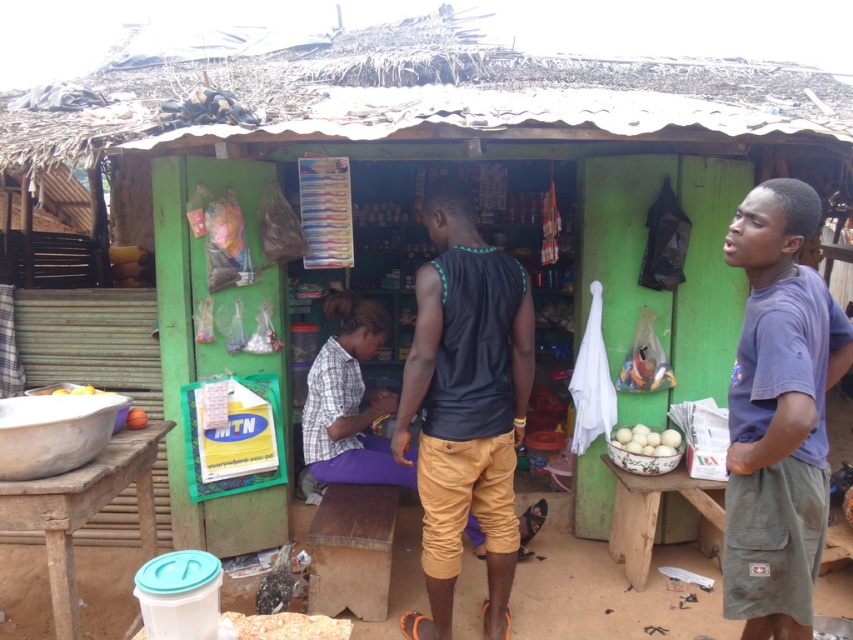
You are a customer in the shop and want to place the white matte eggs at center and the yellow matte fruit at lower left into a small basket that can only hold items narrower than the basket. If the basket is 10 cm wide, which item can fit into the basket?

The white matte eggs at center can fit into the basket since its width is less than the yellow matte fruit at lower left and the basket is 10 cm wide.

You are a customer entering the shop and want to grab both the blue cotton shirt at right and the black matte tank top at center. Which item will you reach first?

The blue cotton shirt at right will be reached first as it is closer to the viewer compared to the black matte tank top at center.